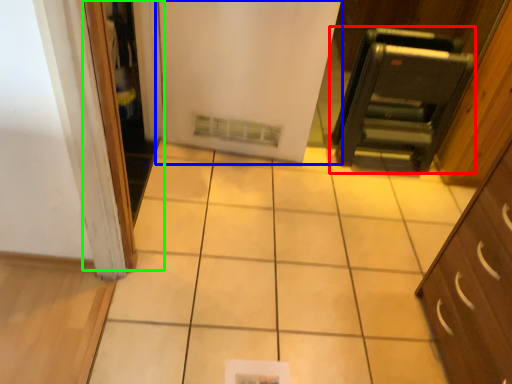
Question: Estimate the real-world distances between objects in this image. Which object is farther from appliance (highlighted by a red box), door (highlighted by a blue box) or screen door (highlighted by a green box)?

Choices:
 (A) door
 (B) screen door

Answer: (B)